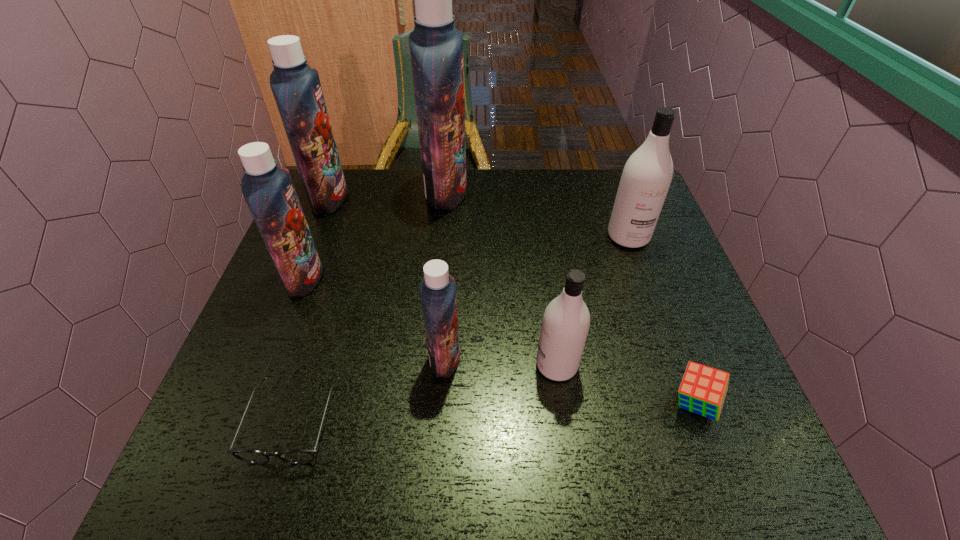
Identify which blue shampoo is the closest to the tallest object. Please provide its 2D coordinates. Your answer should be formatted as a tuple, i.e. [(x, y)], where the tuple contains the x and y coordinates of a point satisfying the conditions above.

[(296, 87)]

Image resolution: width=960 pixels, height=540 pixels. I want to click on vacant space that satisfies the following two spatial constraints: 1. on the front label of the third nearest shampoo; 2. on the back side of the cube, so click(x=256, y=403).

In order to click on free region that satisfies the following two spatial constraints: 1. on the front label of the third smallest blue shampoo; 2. on the left side of the red cube in this screenshot , I will do `click(248, 403)`.

What are the coordinates of `vacant space that satisfies the following two spatial constraints: 1. on the front label of the cube; 2. on the right side of the tallest object` in the screenshot? It's located at (426, 403).

Image resolution: width=960 pixels, height=540 pixels. What are the coordinates of `vacant position in the image that satisfies the following two spatial constraints: 1. on the front label of the tallest shampoo; 2. through the lenses of the black spectacles` in the screenshot? It's located at (425, 421).

In order to click on vacant space that satisfies the following two spatial constraints: 1. on the front label of the biggest blue shampoo; 2. on the left side of the red cube in this screenshot , I will do `click(426, 403)`.

I want to click on free point that satisfies the following two spatial constraints: 1. on the front label of the second tallest object; 2. on the left side of the cube, so click(248, 403).

Where is `free location that satisfies the following two spatial constraints: 1. on the front-facing side of the nearer white shampoo; 2. on the back side of the red cube`? The width and height of the screenshot is (960, 540). free location that satisfies the following two spatial constraints: 1. on the front-facing side of the nearer white shampoo; 2. on the back side of the red cube is located at coordinates click(562, 403).

Locate an element on the screen. The height and width of the screenshot is (540, 960). free space that satisfies the following two spatial constraints: 1. on the front-facing side of the third farthest shampoo; 2. on the front label of the third nearest shampoo is located at coordinates (643, 278).

At what (x,y) coordinates should I click in order to perform the action: click on vacant area in the image that satisfies the following two spatial constraints: 1. on the front label of the nearest blue shampoo; 2. through the lenses of the spectacles. Please return your answer as a coordinate pair (x, y). The width and height of the screenshot is (960, 540). Looking at the image, I should click on (441, 421).